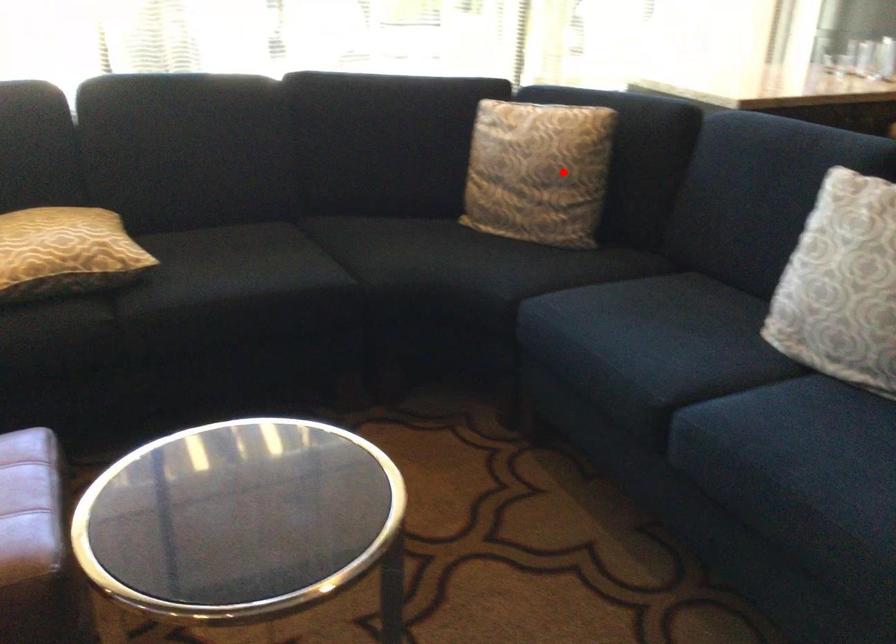
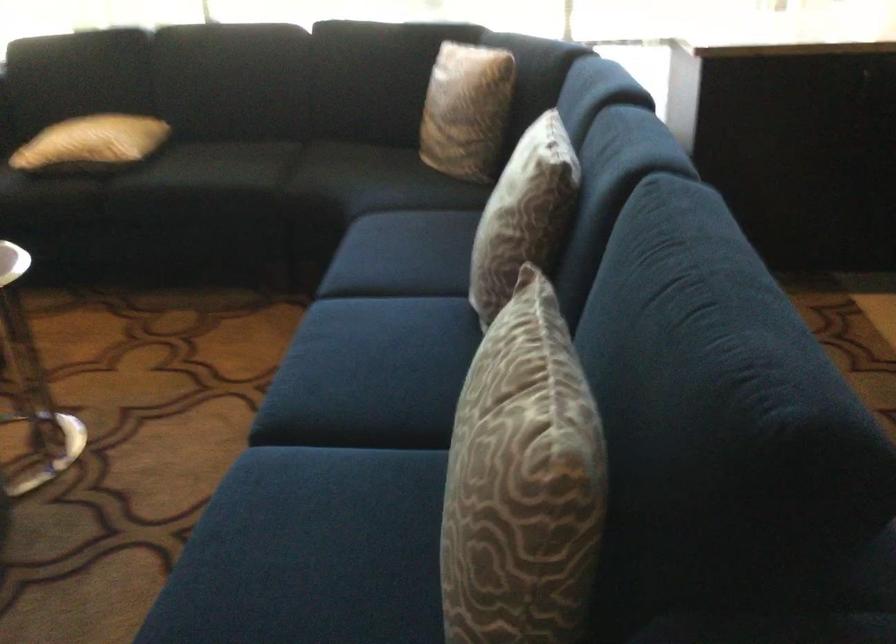
In the second image, find the point that corresponds to the highlighted location in the first image.

(467, 109)